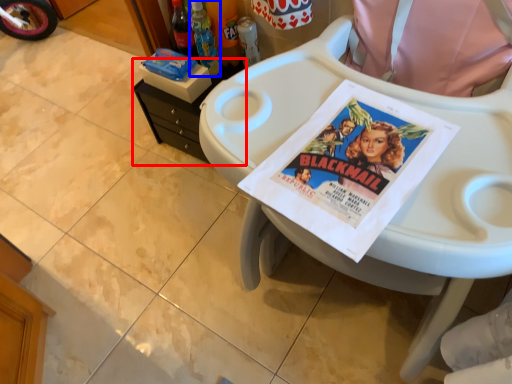
Question: Which object is closer to the camera taking this photo, changing table (highlighted by a red box) or bottle (highlighted by a blue box)?

Choices:
 (A) changing table
 (B) bottle

Answer: (B)